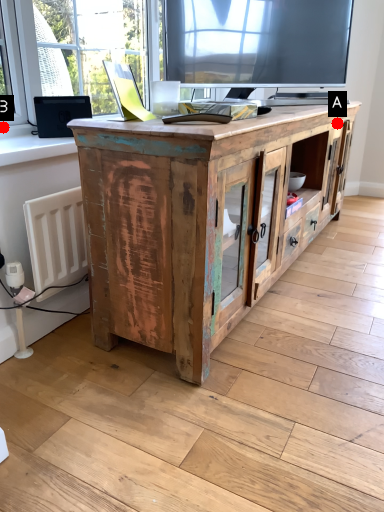
Question: Two points are circled on the image, labeled by A and B beside each circle. Among these points, which one is farthest from the camera?

Choices:
 (A) A is further
 (B) B is further

Answer: (A)